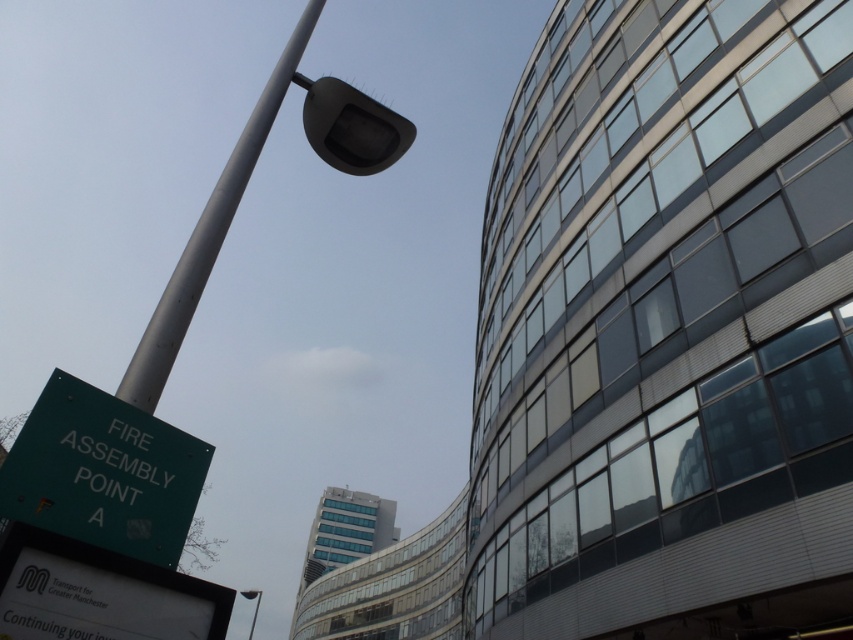
Who is more distant from viewer, [119,385] or [252,627]?

The point [252,627] is more distant.

Is point (213, 237) behind point (252, 593)?

No, it is in front of (252, 593).

Where is `silver metallic pole at upper left`? This screenshot has width=853, height=640. silver metallic pole at upper left is located at coordinates [x=209, y=234].

Is point (26, 486) behind point (252, 632)?

No.

This screenshot has height=640, width=853. Describe the element at coordinates (103, 472) in the screenshot. I see `green matte sign at lower left` at that location.

Which is in front, point (144, 420) or point (256, 593)?

Point (144, 420) is more forward.

The image size is (853, 640). I want to click on green matte sign at lower left, so click(x=103, y=472).

Is green matte sign at lower left thinner than silver metallic pole at upper left?

Yes.

Can you confirm if green matte sign at lower left is wider than silver metallic pole at upper left?

No.

The height and width of the screenshot is (640, 853). Describe the element at coordinates (103, 472) in the screenshot. I see `green matte sign at lower left` at that location.

Where is `green matte sign at lower left`? The height and width of the screenshot is (640, 853). green matte sign at lower left is located at coordinates (103, 472).